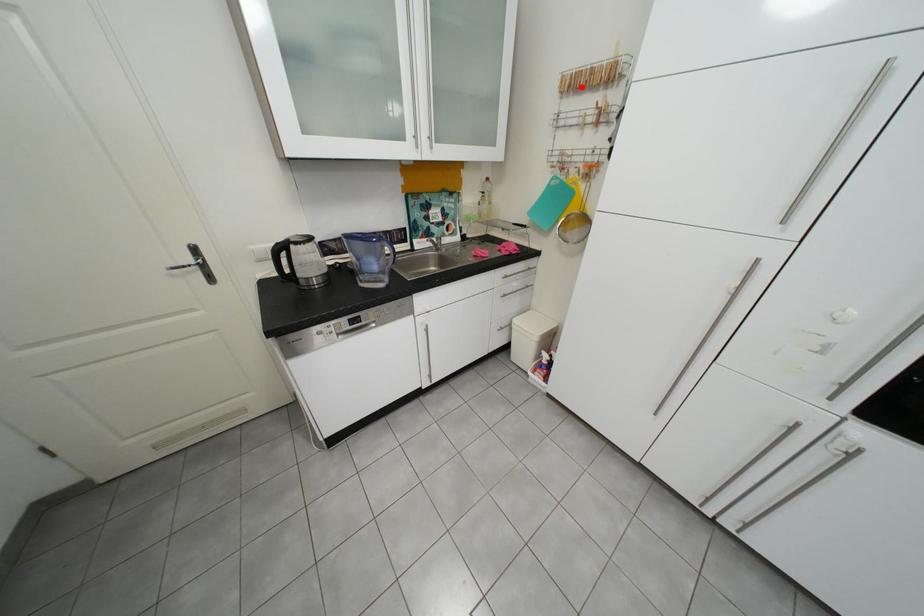
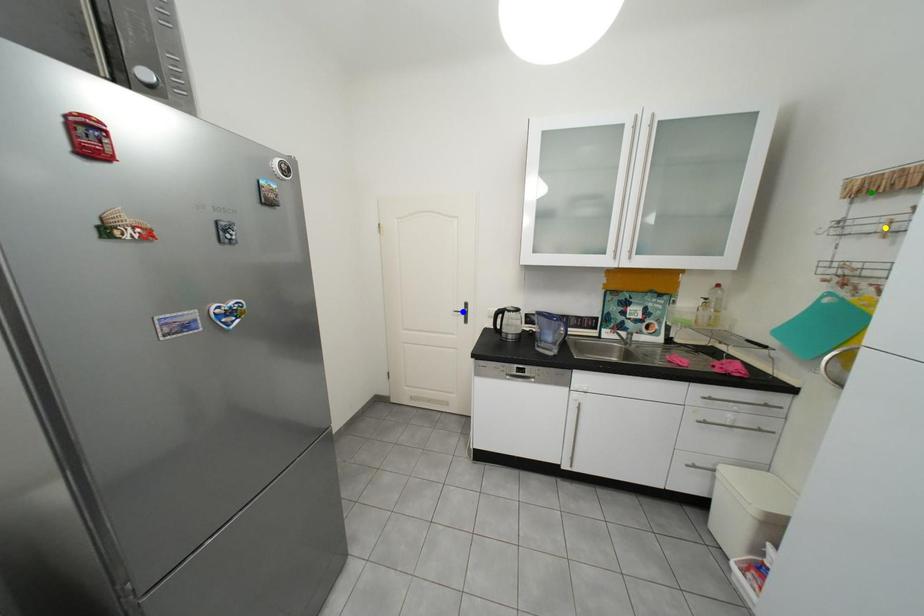
Question: I am providing you with two images of the same scene from different viewpoints. A red point is marked on the first image. You are given multiple points on the second image. Which mark in image 2 goes with the point in image 1?

Choices:
 (A) green point
 (B) blue point
 (C) yellow point

Answer: (A)